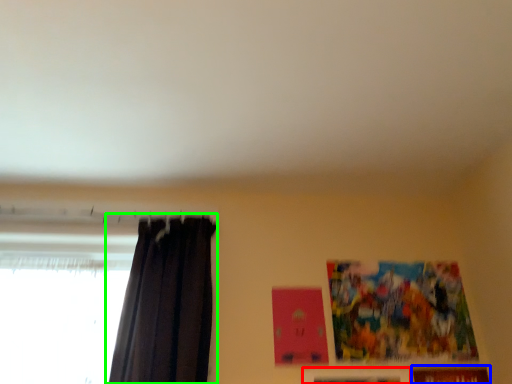
Question: Which object is positioned farthest from picture frame (highlighted by a red box)? Select from picture frame (highlighted by a blue box) and curtain (highlighted by a green box).

Choices:
 (A) picture frame
 (B) curtain

Answer: (B)